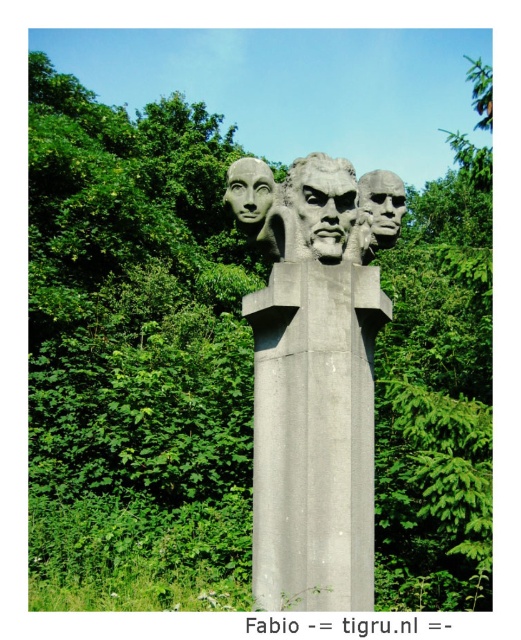
Question: Is the position of gray concrete pillar at center less distant than that of matte gray face at center?

Choices:
 (A) yes
 (B) no

Answer: (A)

Question: Can you confirm if sculpted stone head at center is positioned to the left of matte gray stone face at center?

Choices:
 (A) no
 (B) yes

Answer: (A)

Question: Based on their relative distances, which object is farther from the matte gray stone face at center?

Choices:
 (A) gray concrete pillar at center
 (B) sculpted stone head at center

Answer: (A)

Question: Which is nearer to the matte gray stone face at center?

Choices:
 (A) sculpted stone head at center
 (B) matte gray face at center
 (C) gray concrete pillar at center

Answer: (A)

Question: From the image, what is the correct spatial relationship of gray concrete pillar at center in relation to matte gray stone face at center?

Choices:
 (A) below
 (B) above

Answer: (A)

Question: Which point appears farthest from the camera in this image?

Choices:
 (A) (386, 212)
 (B) (249, 218)
 (C) (341, 579)
 (D) (303, 246)

Answer: (A)